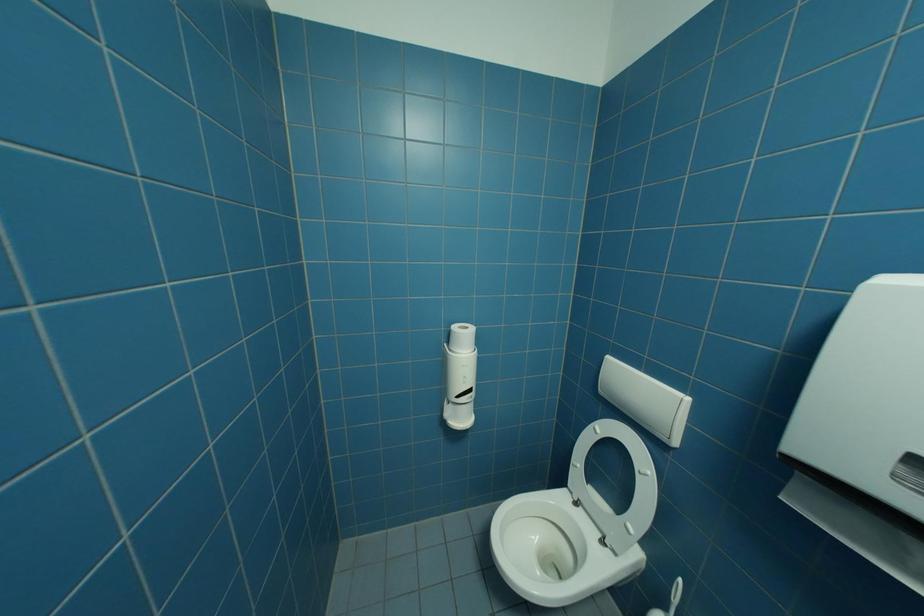
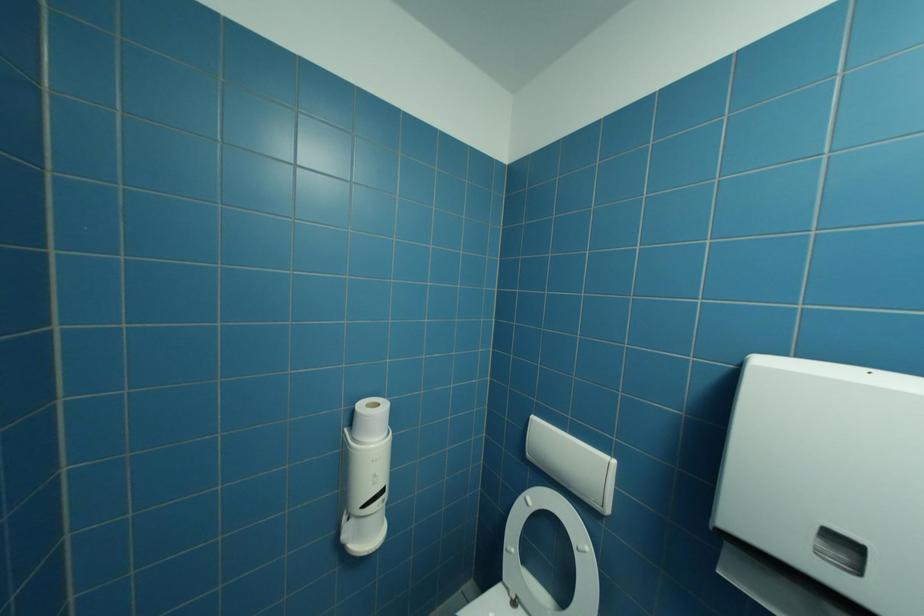
Question: The images are taken continuously from a first-person perspective. In which direction are you moving?

Choices:
 (A) Left
 (B) Right
 (C) Forward
 (D) Backward

Answer: (C)